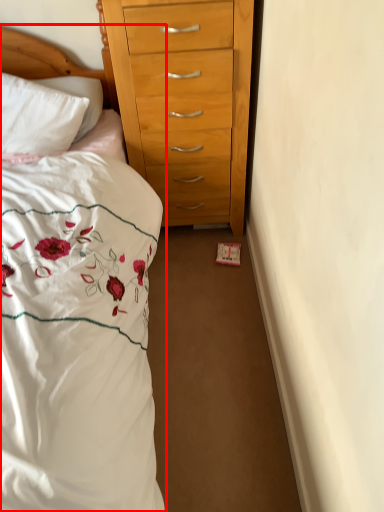
Question: From the image's perspective, where is bed (annotated by the red box) located in relation to headboard in the image?

Choices:
 (A) below
 (B) above

Answer: (A)